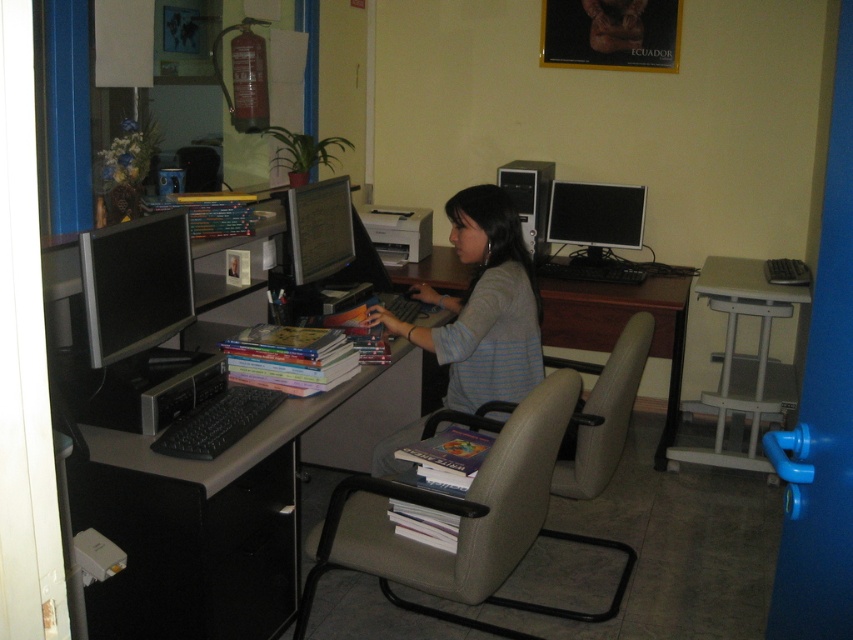
Question: Based on their relative distances, which object is nearer to the gray leather swivel chair at center?

Choices:
 (A) matte black monitor at center
 (B) satin silver desktop at center
 (C) black glossy monitor at upper right

Answer: (A)

Question: Estimate the real-world distances between objects in this image. Which object is farther from the satin silver desktop at center?

Choices:
 (A) matte black monitor at left
 (B) gray striped shirt at center
 (C) black glossy monitor at upper right
 (D) brown wood desk at center

Answer: (A)

Question: Which object is closer to the camera taking this photo?

Choices:
 (A) gray striped shirt at center
 (B) white plastic table at right
 (C) matte black monitor at left

Answer: (C)

Question: Does gray leather swivel chair at center lie in front of gray striped shirt at center?

Choices:
 (A) yes
 (B) no

Answer: (A)

Question: Can you confirm if black plastic desk at lower left is positioned to the right of matte black monitor at left?

Choices:
 (A) no
 (B) yes

Answer: (B)

Question: Is gray leather swivel chair at center above black glossy monitor at upper right?

Choices:
 (A) no
 (B) yes

Answer: (A)